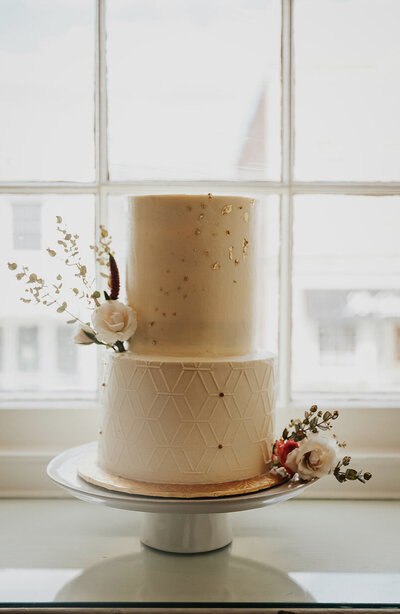
At what (x,y) coordinates should I click in order to perform the action: click on glass countertop. Please return your answer as a coordinate pair (x, y). Looking at the image, I should click on (67, 554).